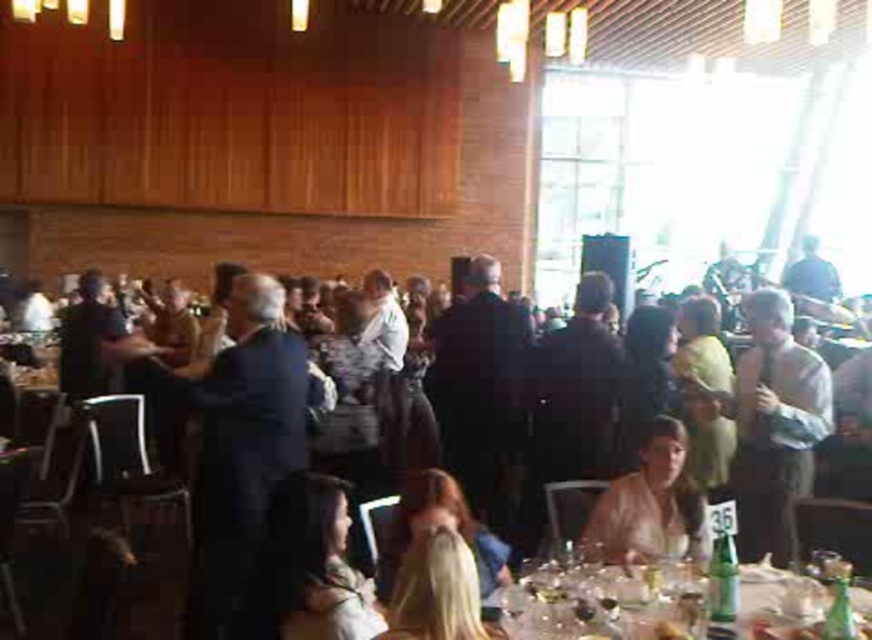
Question: Estimate the real-world distances between objects in this image. Which object is closer to the translucent glassware at lower right?

Choices:
 (A) light brown hair at lower center
 (B) dark brown hair at lower center

Answer: (A)

Question: Is translucent glassware at lower right positioned before dark brown hair at lower center?

Choices:
 (A) yes
 (B) no

Answer: (B)

Question: Is dark brown hair at lower center further to the viewer compared to light brown hair at lower center?

Choices:
 (A) no
 (B) yes

Answer: (A)

Question: Which of the following is the farthest from the observer?

Choices:
 (A) light brown hair at lower center
 (B) translucent glassware at lower right

Answer: (A)

Question: Among these objects, which one is farthest from the camera?

Choices:
 (A) light brown hair at lower center
 (B) translucent glassware at lower right
 (C) dark brown hair at lower center

Answer: (A)

Question: Considering the relative positions of translucent glassware at lower right and light brown hair at lower center in the image provided, where is translucent glassware at lower right located with respect to light brown hair at lower center?

Choices:
 (A) right
 (B) left

Answer: (B)